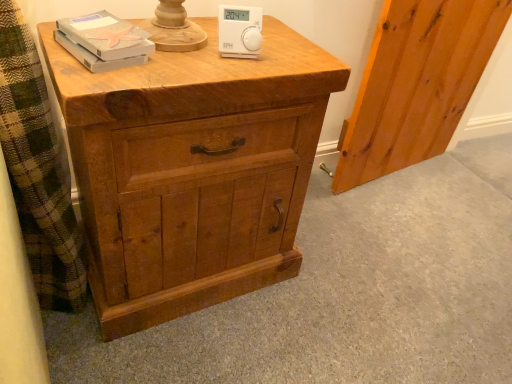
Question: Considering the positions of natural wood screen door at right and matte gray book at upper left in the image, is natural wood screen door at right taller or shorter than matte gray book at upper left?

Choices:
 (A) tall
 (B) short

Answer: (A)

Question: From a real-world perspective, is natural wood screen door at right positioned above or below matte gray book at upper left?

Choices:
 (A) above
 (B) below

Answer: (B)

Question: Which is farther from the natural wood chest of drawers at center?

Choices:
 (A) matte gray book at upper left
 (B) white plastic thermostat at upper center
 (C) natural wood screen door at right

Answer: (C)

Question: Which object is the closest to the natural wood screen door at right?

Choices:
 (A) white plastic thermostat at upper center
 (B) matte gray book at upper left
 (C) natural wood chest of drawers at center

Answer: (C)